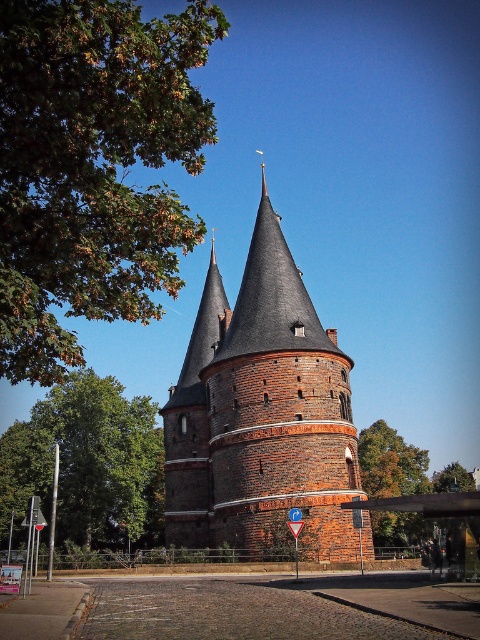
Between brick tower at center and green leafy tree at left, which one has more height?

brick tower at center is taller.

Locate an element on the screen. The image size is (480, 640). brick tower at center is located at coordinates (260, 412).

Locate an element on the screen. brick tower at center is located at coordinates (260, 412).

The width and height of the screenshot is (480, 640). Describe the element at coordinates (93, 166) in the screenshot. I see `green leafy tree at upper left` at that location.

Who is lower down, green leafy tree at upper left or green leafy tree at left?

green leafy tree at left is lower down.

The width and height of the screenshot is (480, 640). What do you see at coordinates (93, 166) in the screenshot?
I see `green leafy tree at upper left` at bounding box center [93, 166].

The image size is (480, 640). What are the coordinates of `green leafy tree at upper left` in the screenshot? It's located at (93, 166).

This screenshot has width=480, height=640. What do you see at coordinates (87, 464) in the screenshot?
I see `green leafy tree at left` at bounding box center [87, 464].

Is green leafy tree at left positioned behind metallic street sign at lower left?

Yes, it is.

The image size is (480, 640). In order to click on green leafy tree at left in this screenshot , I will do `click(87, 464)`.

The height and width of the screenshot is (640, 480). I want to click on green leafy tree at left, so click(87, 464).